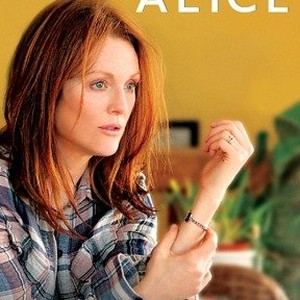
Locate an element on the screen. The height and width of the screenshot is (300, 300). wicker chair is located at coordinates (242, 282).